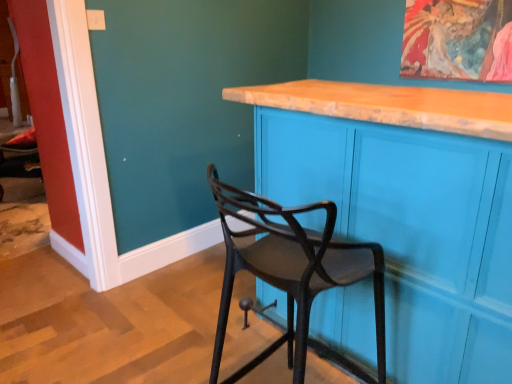
Describe the element at coordinates (407, 207) in the screenshot. I see `matte blue cabinet at center` at that location.

What is the approximate width of matte blue cabinet at center?

matte blue cabinet at center is 26.23 inches in width.

Find the location of a particular element. Image resolution: width=512 pixels, height=384 pixels. matte blue cabinet at center is located at coordinates (407, 207).

Where is `matte black chair at center`? matte black chair at center is located at coordinates (294, 275).

Describe the element at coordinates (294, 275) in the screenshot. I see `matte black chair at center` at that location.

The width and height of the screenshot is (512, 384). I want to click on matte blue cabinet at center, so click(407, 207).

Would you say matte black chair at center is to the left or to the right of matte blue cabinet at center in the picture?

From the image, it's evident that matte black chair at center is to the left of matte blue cabinet at center.

Is the depth of matte black chair at center less than that of matte blue cabinet at center?

Yes, the depth of matte black chair at center is less than that of matte blue cabinet at center.

Is point (286, 274) more distant than point (459, 156)?

No, it is in front of (459, 156).

From the image's perspective, which object appears higher, matte black chair at center or matte blue cabinet at center?

From the image's view, matte blue cabinet at center is above.

From a real-world perspective, is matte black chair at center on top of matte blue cabinet at center?

No, from a real-world perspective, matte black chair at center is not above matte blue cabinet at center.

Between matte black chair at center and matte blue cabinet at center, which one has larger width?

With larger width is matte blue cabinet at center.

Is matte black chair at center shorter than matte blue cabinet at center?

Correct, matte black chair at center is not as tall as matte blue cabinet at center.

Which of these two, matte black chair at center or matte blue cabinet at center, is bigger?

matte blue cabinet at center is bigger.

Choose the correct answer: Is matte black chair at center inside matte blue cabinet at center or outside it?

matte black chair at center is spatially situated outside matte blue cabinet at center.

Is matte black chair at center positioned far away from matte blue cabinet at center?

No.

Is matte black chair at center positioned with its back to matte blue cabinet at center?

That's not correct — matte black chair at center is not looking away from matte blue cabinet at center.

Based on the photo, how many degrees apart are the facing directions of matte black chair at center and matte blue cabinet at center?

There is a 2.01-degree angle between the facing directions of matte black chair at center and matte blue cabinet at center.

Identify the location of cabinetry above the matte black chair at center (from a real-world perspective). The width and height of the screenshot is (512, 384). (x=407, y=207).

Is matte blue cabinet at center at the left side of matte black chair at center?

In fact, matte blue cabinet at center is to the right of matte black chair at center.

Which object is further away from the camera, matte blue cabinet at center or matte black chair at center?

Positioned behind is matte blue cabinet at center.

Does point (335, 139) lie in front of point (265, 203)?

No, it is not.

From the image's perspective, would you say matte blue cabinet at center is positioned over matte black chair at center?

Yes, from the image's perspective, matte blue cabinet at center is above matte black chair at center.

From a real-world perspective, is matte blue cabinet at center on matte black chair at center?

Yes, from a real-world perspective, matte blue cabinet at center is over matte black chair at center

In terms of width, does matte blue cabinet at center look wider or thinner when compared to matte black chair at center?

Considering their sizes, matte blue cabinet at center looks broader than matte black chair at center.

Is matte blue cabinet at center shorter than matte black chair at center?

Incorrect, the height of matte blue cabinet at center does not fall short of that of matte black chair at center.

Which of these two, matte blue cabinet at center or matte black chair at center, is bigger?

matte blue cabinet at center is bigger.

Is matte blue cabinet at center located outside matte black chair at center?

Yes, matte blue cabinet at center is not within matte black chair at center.

Is matte blue cabinet at center not near matte black chair at center?

No, matte blue cabinet at center is not far away from matte black chair at center.

Is matte blue cabinet at center aimed at matte black chair at center?

Yes, matte blue cabinet at center is turned towards matte black chair at center.

Can you tell me how much matte blue cabinet at center and matte black chair at center differ in facing direction?

The angular difference between matte blue cabinet at center and matte black chair at center is 2.01 degrees.

Where is `cabinetry behind the matte black chair at center`? This screenshot has height=384, width=512. cabinetry behind the matte black chair at center is located at coordinates (407, 207).

Find the location of a particular element. Image resolution: width=512 pixels, height=384 pixels. chair that appears on the left of matte blue cabinet at center is located at coordinates (294, 275).

Locate an element on the screen. The width and height of the screenshot is (512, 384). chair below the matte blue cabinet at center (from a real-world perspective) is located at coordinates (294, 275).